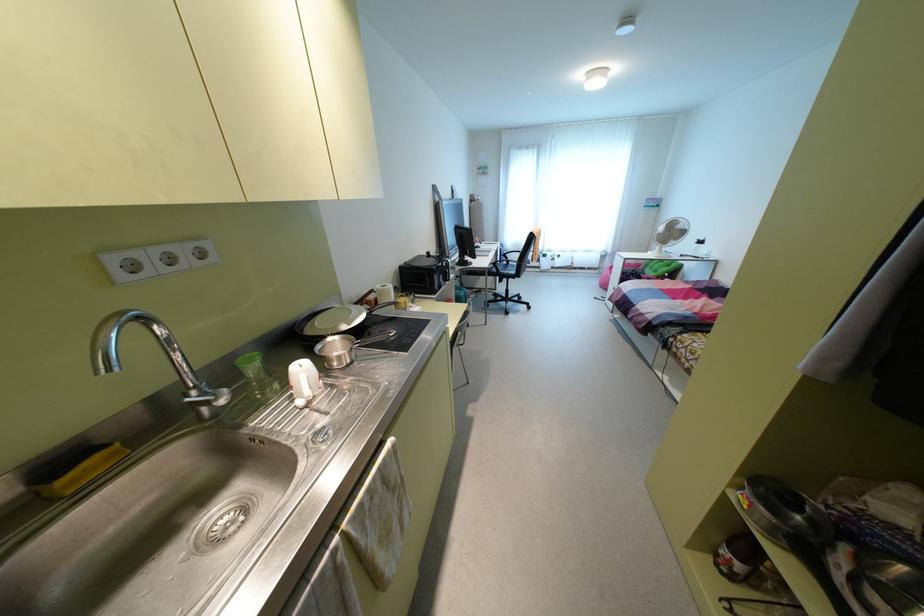
Describe the element at coordinates (334, 320) in the screenshot. I see `the white plate` at that location.